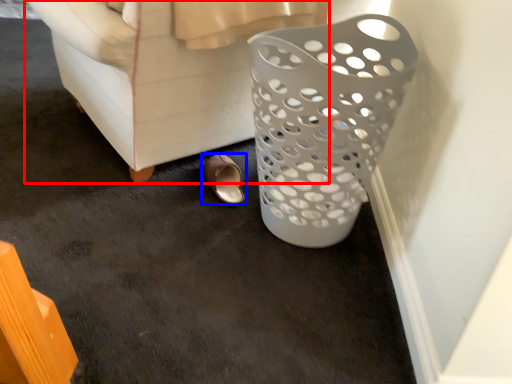
Question: Among these objects, which one is nearest to the camera, furniture (highlighted by a red box) or footwear (highlighted by a blue box)?

Choices:
 (A) furniture
 (B) footwear

Answer: (A)